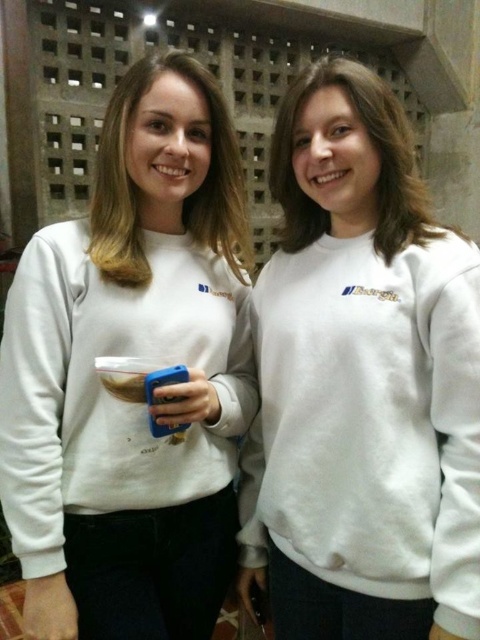
Question: Does white fleece sweatshirt at center appear under white matte sweatshirt at center?

Choices:
 (A) no
 (B) yes

Answer: (B)

Question: Does white fleece sweatshirt at center appear under white matte sweatshirt at center?

Choices:
 (A) yes
 (B) no

Answer: (A)

Question: Where is white fleece sweatshirt at center located in relation to white matte sweatshirt at center in the image?

Choices:
 (A) left
 (B) right

Answer: (B)

Question: Which point appears farthest from the camera in this image?

Choices:
 (A) (348, 508)
 (B) (204, 326)

Answer: (B)

Question: Which of the following is the farthest from the observer?

Choices:
 (A) (373, 374)
 (B) (58, 417)

Answer: (B)